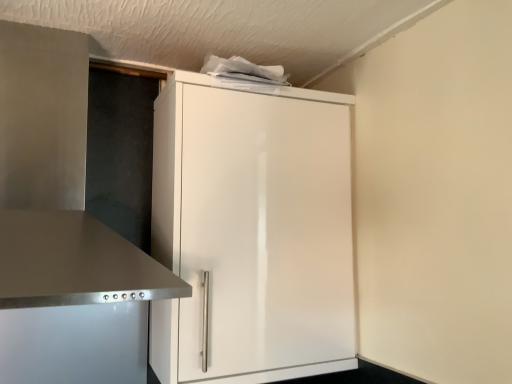
Question: Considering their positions, is stainless steel vent at left located in front of or behind white glossy cupboard at center?

Choices:
 (A) behind
 (B) front

Answer: (B)

Question: From a real-world perspective, relative to white glossy cupboard at center, is stainless steel vent at left vertically above or below?

Choices:
 (A) above
 (B) below

Answer: (A)

Question: Looking at their shapes, would you say stainless steel vent at left is wider or thinner than white glossy cupboard at center?

Choices:
 (A) thin
 (B) wide

Answer: (B)

Question: From a real-world perspective, is white glossy cupboard at center physically located above or below stainless steel vent at left?

Choices:
 (A) below
 (B) above

Answer: (A)

Question: Would you say white glossy cupboard at center is inside or outside stainless steel vent at left?

Choices:
 (A) inside
 (B) outside

Answer: (B)

Question: Relative to stainless steel vent at left, is white glossy cupboard at center in front or behind?

Choices:
 (A) behind
 (B) front

Answer: (A)

Question: In terms of height, does white glossy cupboard at center look taller or shorter compared to stainless steel vent at left?

Choices:
 (A) tall
 (B) short

Answer: (A)